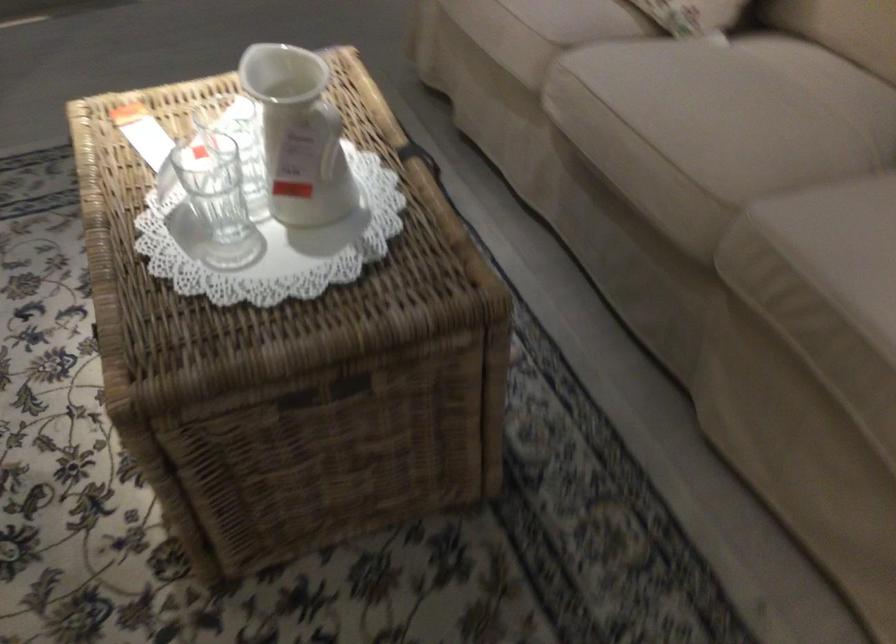
You are a GUI agent. You are given a task and a screenshot of the screen. Output one action in this format:
    pyautogui.click(x=<x>, y=<y>)
    Task: Click on the white pitcher handle
    The image size is (896, 644).
    Given the screenshot: What is the action you would take?
    pyautogui.click(x=328, y=137)